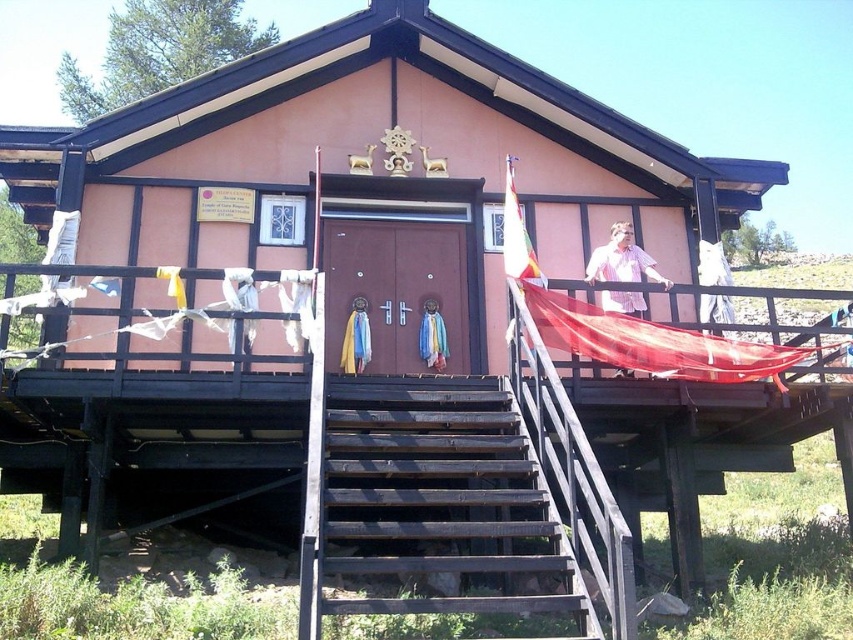
Question: Which object is farther from the camera taking this photo?

Choices:
 (A) dark brown wooden stairs at center
 (B) pink striped shirt at upper center

Answer: (B)

Question: Does dark brown wooden stairs at center have a lesser width compared to pink striped shirt at upper center?

Choices:
 (A) yes
 (B) no

Answer: (B)

Question: Is dark brown wooden stairs at center positioned behind pink striped shirt at upper center?

Choices:
 (A) yes
 (B) no

Answer: (B)

Question: Is dark brown wooden stairs at center positioned before pink striped shirt at upper center?

Choices:
 (A) yes
 (B) no

Answer: (A)